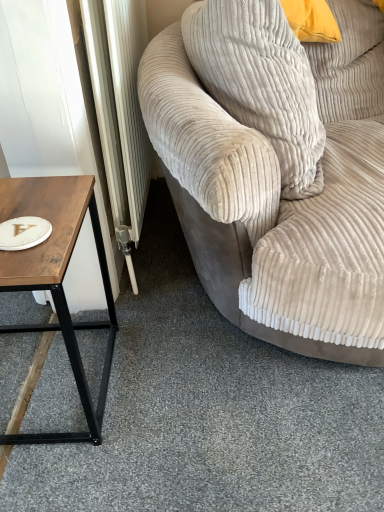
Question: Is the depth of wooden table at left greater than that of beige corduroy pillow at upper right?

Choices:
 (A) no
 (B) yes

Answer: (A)

Question: Would you say beige corduroy pillow at upper right is part of wooden table at left's contents?

Choices:
 (A) no
 (B) yes

Answer: (A)

Question: Considering the relative sizes of wooden table at left and beige corduroy pillow at upper right in the image provided, is wooden table at left wider than beige corduroy pillow at upper right?

Choices:
 (A) no
 (B) yes

Answer: (B)

Question: Considering the relative positions of wooden table at left and beige corduroy pillow at upper right in the image provided, is wooden table at left to the left of beige corduroy pillow at upper right from the viewer's perspective?

Choices:
 (A) yes
 (B) no

Answer: (A)

Question: From the image's perspective, is wooden table at left under beige corduroy pillow at upper right?

Choices:
 (A) no
 (B) yes

Answer: (B)

Question: Considering the positions of beige corduroy couch at right and white matte paper plate at left in the image, is beige corduroy couch at right wider or thinner than white matte paper plate at left?

Choices:
 (A) thin
 (B) wide

Answer: (B)

Question: From the image's perspective, is beige corduroy couch at right above or below white matte paper plate at left?

Choices:
 (A) below
 (B) above

Answer: (B)

Question: Considering the positions of point (292, 284) and point (46, 226), is point (292, 284) closer or farther from the camera than point (46, 226)?

Choices:
 (A) closer
 (B) farther

Answer: (B)

Question: Based on their positions, is beige corduroy couch at right located to the left or right of white matte paper plate at left?

Choices:
 (A) right
 (B) left

Answer: (A)

Question: From the image's perspective, is wooden table at left located above or below beige corduroy couch at right?

Choices:
 (A) below
 (B) above

Answer: (A)

Question: In terms of size, does wooden table at left appear bigger or smaller than beige corduroy couch at right?

Choices:
 (A) small
 (B) big

Answer: (A)

Question: Is wooden table at left inside or outside of beige corduroy couch at right?

Choices:
 (A) inside
 (B) outside

Answer: (B)

Question: Looking at their shapes, would you say wooden table at left is wider or thinner than beige corduroy couch at right?

Choices:
 (A) thin
 (B) wide

Answer: (A)

Question: Considering the positions of beige corduroy couch at right and beige corduroy pillow at upper right in the image, is beige corduroy couch at right taller or shorter than beige corduroy pillow at upper right?

Choices:
 (A) short
 (B) tall

Answer: (B)

Question: Considering the positions of beige corduroy couch at right and beige corduroy pillow at upper right in the image, is beige corduroy couch at right wider or thinner than beige corduroy pillow at upper right?

Choices:
 (A) wide
 (B) thin

Answer: (A)